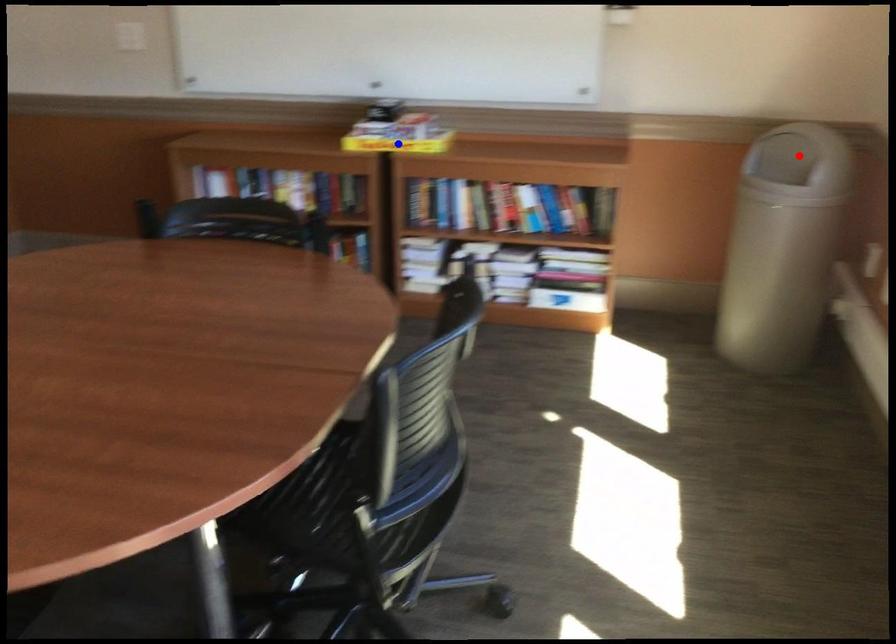
Question: Which of the two points in the image is closer to the camera?

Choices:
 (A) Blue point is closer.
 (B) Red point is closer.

Answer: (B)